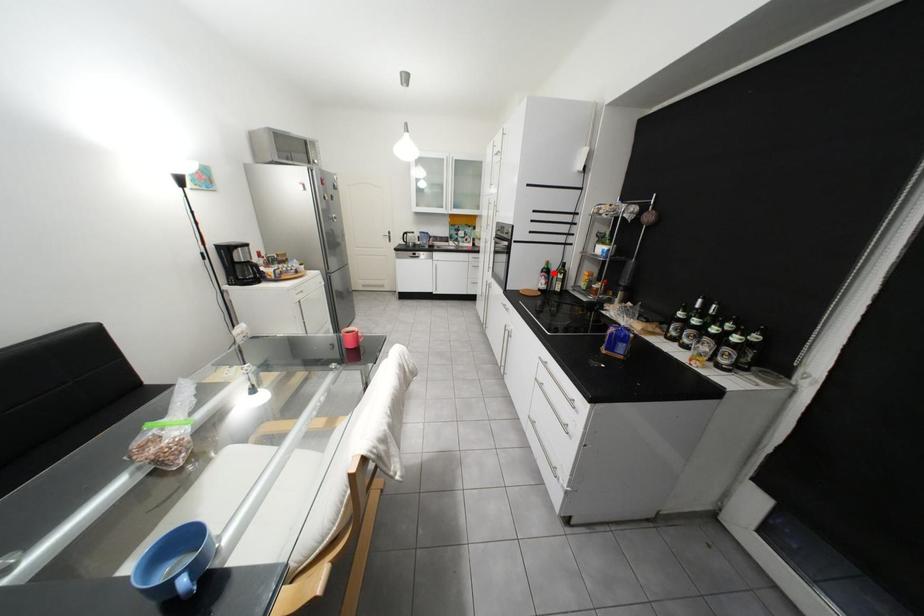
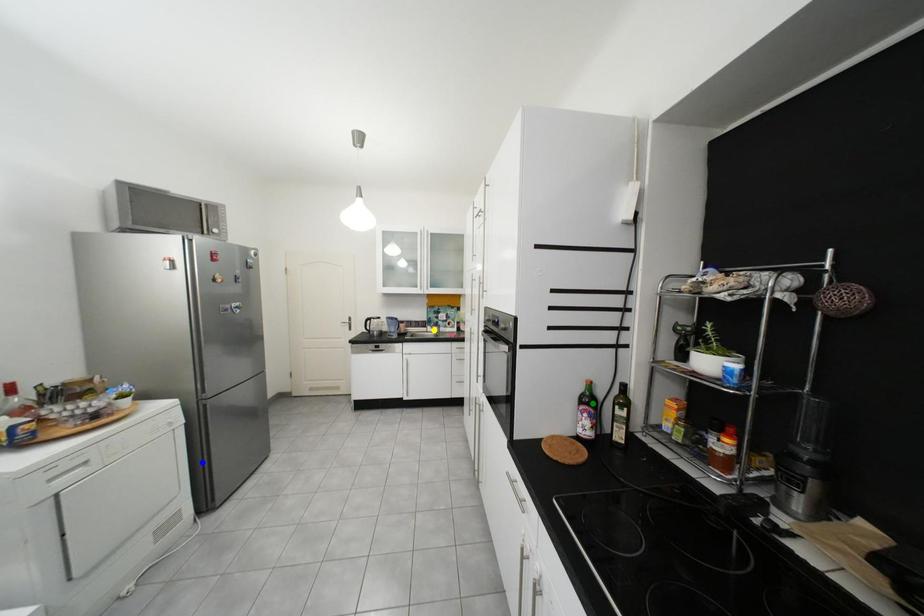
Question: I am providing you with two images of the same scene from different viewpoints. A red point is marked on the first image. You are given multiple points on the second image. Which spot in image 2 lines up with the point in image 1?

Choices:
 (A) green point
 (B) yellow point
 (C) blue point

Answer: (A)